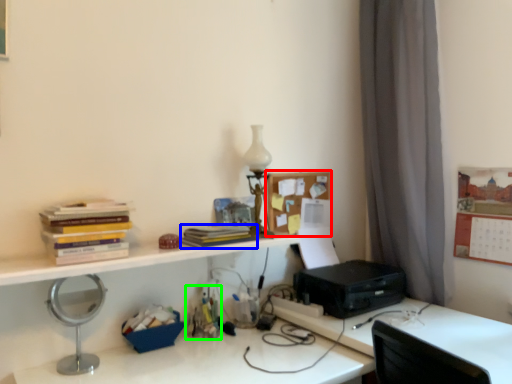
Question: Estimate the real-world distances between objects in this image. Which object is farther from shelf (highlighted by a red box), paperback book (highlighted by a blue box) or stationery (highlighted by a green box)?

Choices:
 (A) paperback book
 (B) stationery

Answer: (B)